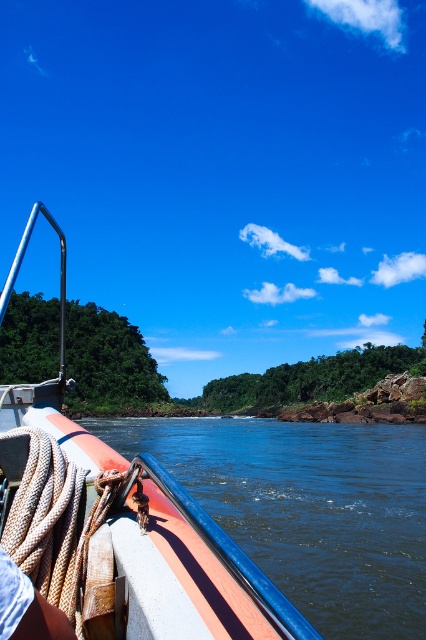
You are standing on the deck of the boat and want to retrieve the orange rubber boat at left. Considering your arm reaches 1.8 meters, can you reach it without moving?

The orange rubber boat at left is 2.20 meters away from you, which is beyond your arm reach of 1.8 meters. You need to move closer to grab it.

You are on a boat and need to store two rubber boats. The orange rubber boat at left and the smooth rubber boat at lower left are both in your way. Which one can you stack on top of the other to save space?

The orange rubber boat at left has a greater height compared to the smooth rubber boat at lower left, so you can stack the smooth rubber boat at lower left on top of the orange rubber boat at left to save space.

You are navigating a boat and need to secure an orange rubber boat at left. According to the coordinates provided, where should you place it?

The orange rubber boat at left should be placed at point (118,525) as specified.